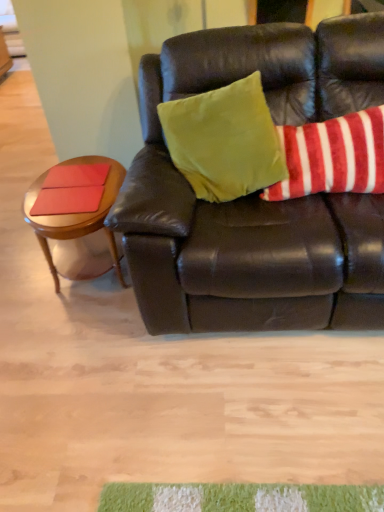
Identify the location of empty space that is in between woodenwoodentable at left and matte brown leather couch at center. The image size is (384, 512). (95, 325).